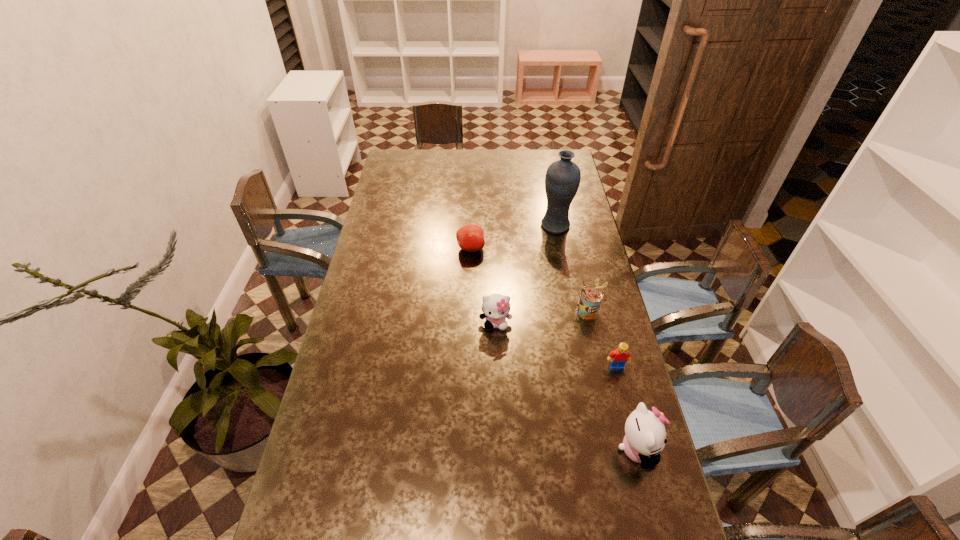
Find the location of `vacant spot to place a kitten on the left`. vacant spot to place a kitten on the left is located at coordinates (402, 239).